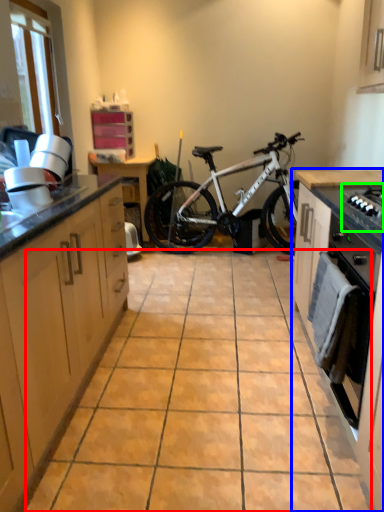
Question: Considering the real-world distances, which object is closest to ceramic tile (highlighted by a red box)? cabinetry (highlighted by a blue box) or gas stove (highlighted by a green box).

Choices:
 (A) cabinetry
 (B) gas stove

Answer: (A)